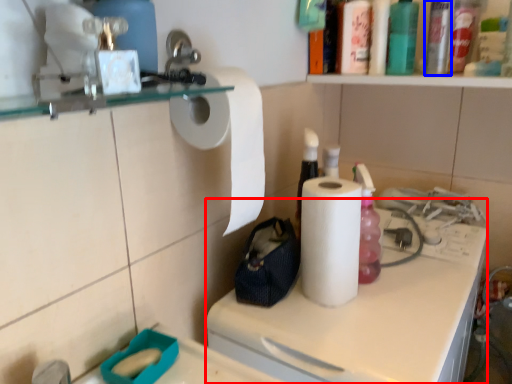
Question: Among these objects, which one is nearest to the camera, counter (highlighted by a red box) or bottle (highlighted by a blue box)?

Choices:
 (A) counter
 (B) bottle

Answer: (A)